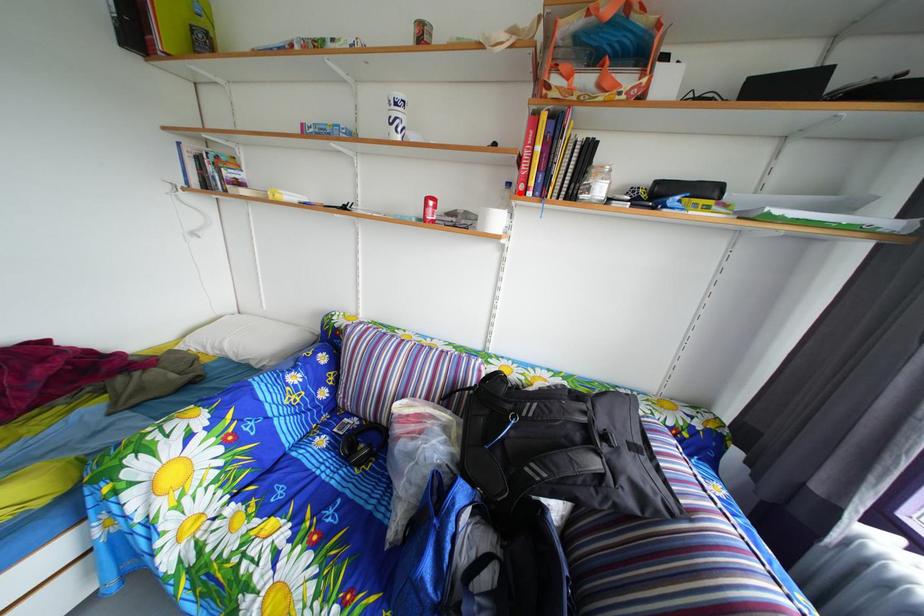
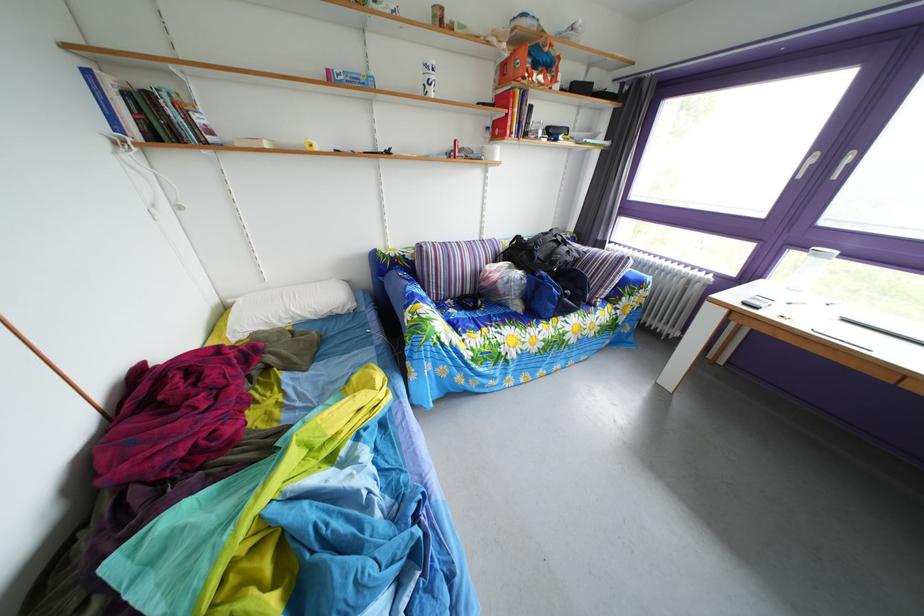
Locate, in the second image, the point that corresponds to the highlighted location in the first image.

(499, 137)